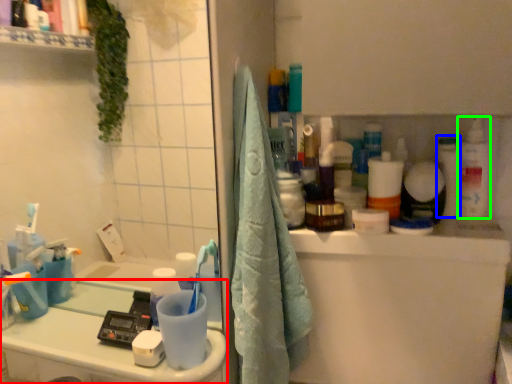
Question: Which is nearer to the counter top (highlighted by a red box)? toiletry (highlighted by a blue box) or cleaning product (highlighted by a green box).

Choices:
 (A) toiletry
 (B) cleaning product

Answer: (A)